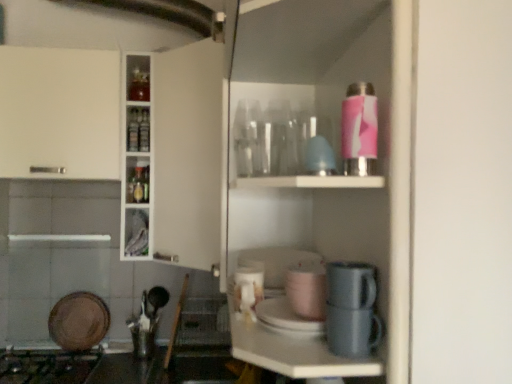
Question: From a real-world perspective, is matte pink cup at center, marked as the third appliance in a bottom-to-top arrangement, physically located above or below black matte gas stove at lower left?

Choices:
 (A) below
 (B) above

Answer: (B)

Question: In terms of width, does matte pink cup at center, positioned as the 3th appliance in left-to-right order, look wider or thinner when compared to black matte gas stove at lower left?

Choices:
 (A) wide
 (B) thin

Answer: (B)

Question: Which object is positioned farthest from the white glossy cup at center, which is counted as the third appliance, starting from the right?

Choices:
 (A) metallic gray coffee machine at lower center
 (B) brown matte plate at lower left, the fourth appliance in the front-to-back sequence
 (C) matte gray mug at lower center, the first appliance from the right
 (D) matte pink cup at center, which is the third appliance in back-to-front order
 (E) black matte gas stove at lower left

Answer: (B)

Question: Based on their relative distances, which object is nearer to the matte gray mug at lower center, which is counted as the 4th appliance, starting from the back?

Choices:
 (A) matte pink cup at center, positioned as the 3th appliance in left-to-right order
 (B) brown matte plate at lower left, which is counted as the 1th appliance, starting from the back
 (C) black matte gas stove at lower left
 (D) white glossy cup at center, which is counted as the third appliance, starting from the top
 (E) metallic gray coffee machine at lower center

Answer: (E)